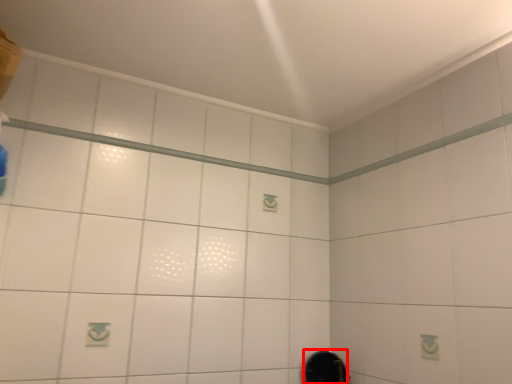
Question: From the image, what is the correct spatial relationship of mirror (annotated by the red box) in relation to shower?

Choices:
 (A) left
 (B) right

Answer: (B)